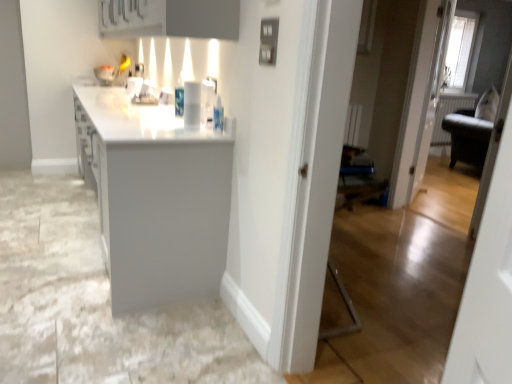
Question: Looking at their shapes, would you say white glossy cup at center is wider or thinner than matte gray cabinet at upper center?

Choices:
 (A) wide
 (B) thin

Answer: (B)

Question: Visually, is white glossy cup at center positioned to the left or to the right of matte gray cabinet at upper center?

Choices:
 (A) right
 (B) left

Answer: (A)

Question: Which is farther from the matte gray cabinet at upper center?

Choices:
 (A) white glossy cup at center
 (B) white glossy countertop at center

Answer: (B)

Question: Based on their relative distances, which object is nearer to the white glossy countertop at center?

Choices:
 (A) matte gray cabinet at upper center
 (B) white glossy cup at center

Answer: (B)